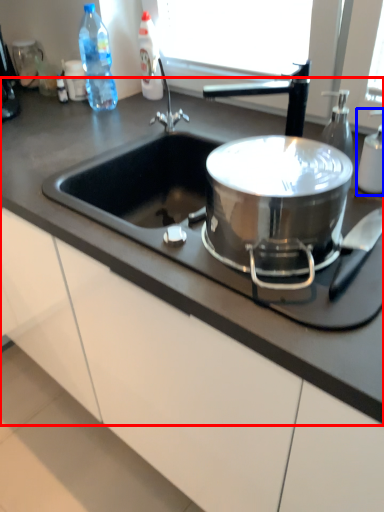
Question: Which object is further to the camera taking this photo, countertop (highlighted by a red box) or bottle (highlighted by a blue box)?

Choices:
 (A) countertop
 (B) bottle

Answer: (B)